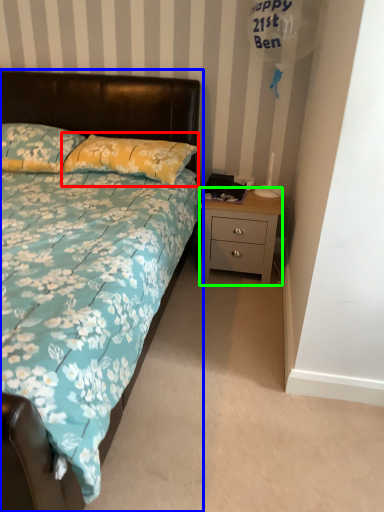
Question: Based on their relative distances, which object is nearer to pillow (highlighted by a red box)? Choose from bed (highlighted by a blue box) and nightstand (highlighted by a green box).

Choices:
 (A) bed
 (B) nightstand

Answer: (A)